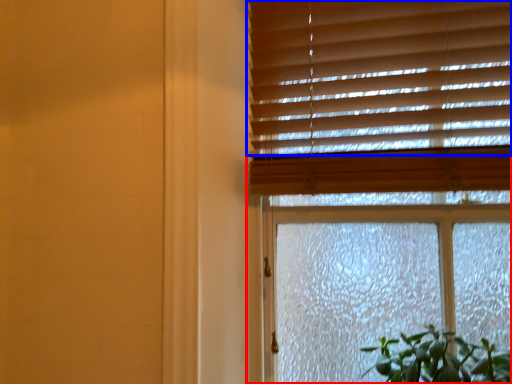
Question: Which of the following is the farthest to the observer, window (highlighted by a red box) or blind (highlighted by a blue box)?

Choices:
 (A) window
 (B) blind

Answer: (B)